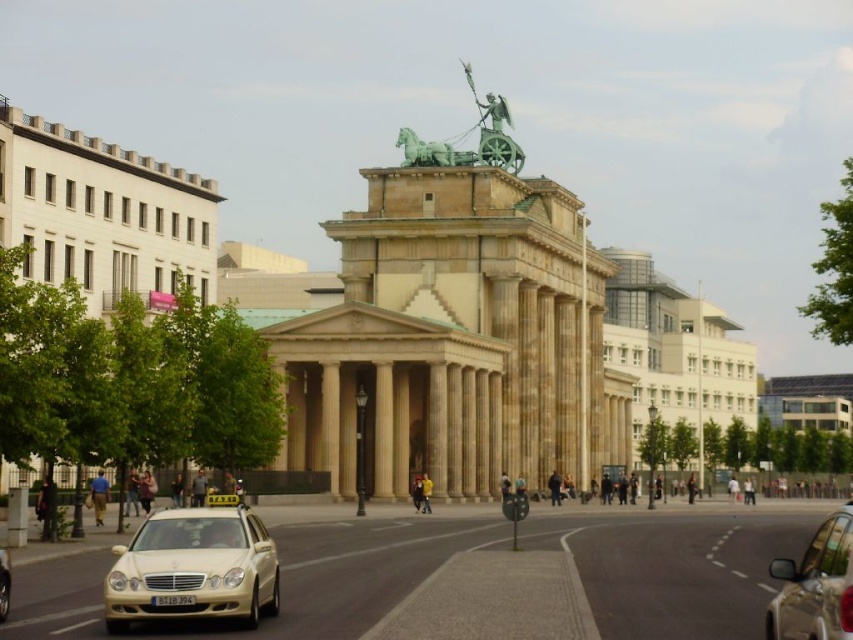
Looking at this image, you are a tourist standing on the sidewalk near the Brandenburg Gate. You see the metallic silver car at lower right and the green polished stone statue at upper center. Which object is closer to you?

The metallic silver car at lower right is closer to you because it is in front of the green polished stone statue at upper center.

You are a tourist standing at the Brandenburg Gate and want to take a photo of both the metallic silver car at lower right and the green polished stone statue at upper center. Which object should you focus on first if you want to capture both in the same frame?

The metallic silver car at lower right is shorter than the green polished stone statue at upper center, so you should focus on the metallic silver car at lower right first to ensure both are in the frame.

You are a tourist standing on the sidewalk near the Brandenburg Gate. You want to take a photo of the green polished metal chariot at center without any vehicles blocking the view. The white glossy taxi at lower left is currently parked in front of the chariot. Can you move the taxi to the side so that the chariot is fully visible?

The white glossy taxi at lower left is narrower than the green polished metal chariot at center. Since the taxi is smaller in width, you can move it to the side to allow the chariot to be fully visible without obstruction.